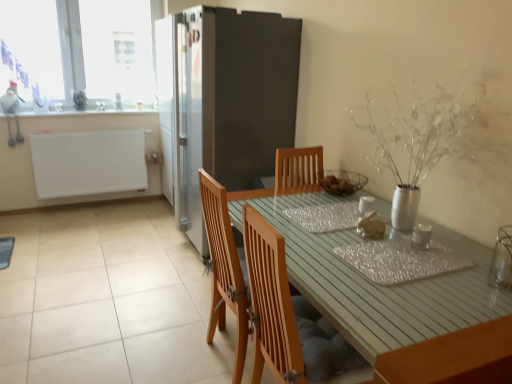
Identify the location of free space to the left of shiny metallic placemat at center. 323,257.